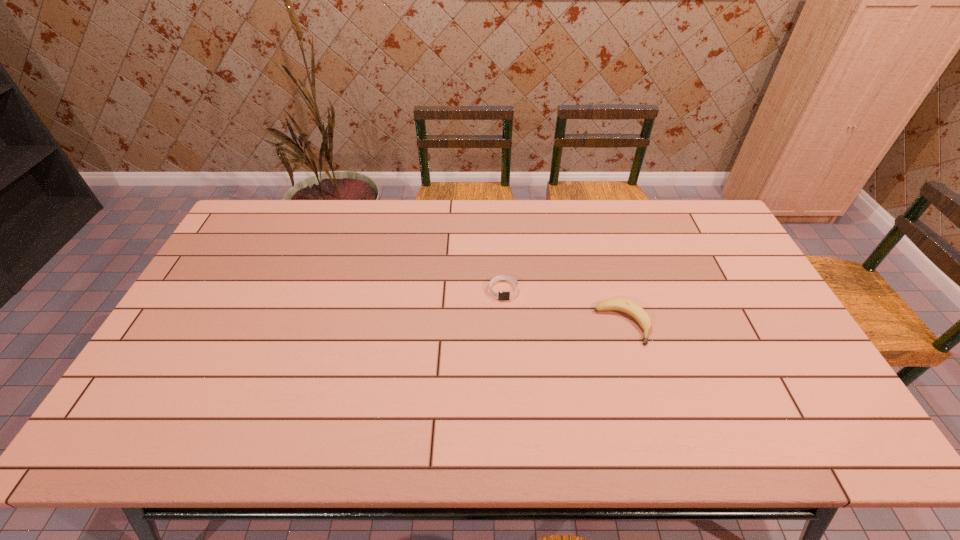
Image resolution: width=960 pixels, height=540 pixels. I want to click on free spot at the far right corner of the desktop, so click(685, 214).

Where is `vacant space at the near right corner`? vacant space at the near right corner is located at coordinates (791, 441).

The width and height of the screenshot is (960, 540). Find the location of `free space in the image that satisfies the following two spatial constraints: 1. on the outer surface of the right object; 2. on the right side of the shorter object`. free space in the image that satisfies the following two spatial constraints: 1. on the outer surface of the right object; 2. on the right side of the shorter object is located at coordinates (505, 325).

Identify the location of vacant region that satisfies the following two spatial constraints: 1. on the outer surface of the nearer object; 2. on the left side of the wristband. (505, 325).

The height and width of the screenshot is (540, 960). In order to click on vacant point that satisfies the following two spatial constraints: 1. on the outer surface of the taller object; 2. on the right side of the shorter object in this screenshot , I will do `click(505, 325)`.

The image size is (960, 540). I want to click on free space that satisfies the following two spatial constraints: 1. on the outer surface of the farther object; 2. on the right side of the right object, so click(x=505, y=325).

What are the coordinates of `free space that satisfies the following two spatial constraints: 1. on the outer surface of the nearer object; 2. on the right side of the wristband` in the screenshot? It's located at (505, 325).

In order to click on vacant space that satisfies the following two spatial constraints: 1. on the outer surface of the banana; 2. on the left side of the wristband in this screenshot , I will do `click(505, 325)`.

Locate an element on the screen. Image resolution: width=960 pixels, height=540 pixels. vacant area that satisfies the following two spatial constraints: 1. on the outer surface of the shorter object; 2. on the left side of the taller object is located at coordinates 505,325.

Locate an element on the screen. The height and width of the screenshot is (540, 960). free spot that satisfies the following two spatial constraints: 1. on the outer surface of the nearer object; 2. on the right side of the left object is located at coordinates (505, 325).